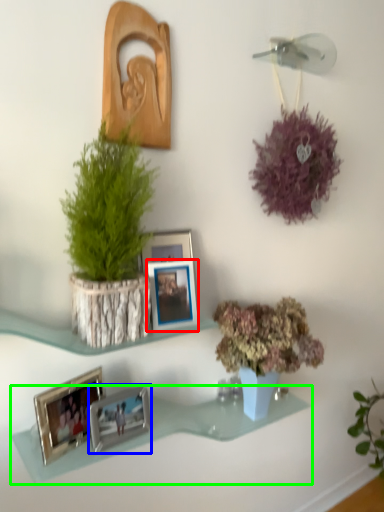
Question: Which object is the closest to the picture frame (highlighted by a red box)? Choose among these: picture frame (highlighted by a blue box) or shelf (highlighted by a green box).

Choices:
 (A) picture frame
 (B) shelf

Answer: (A)